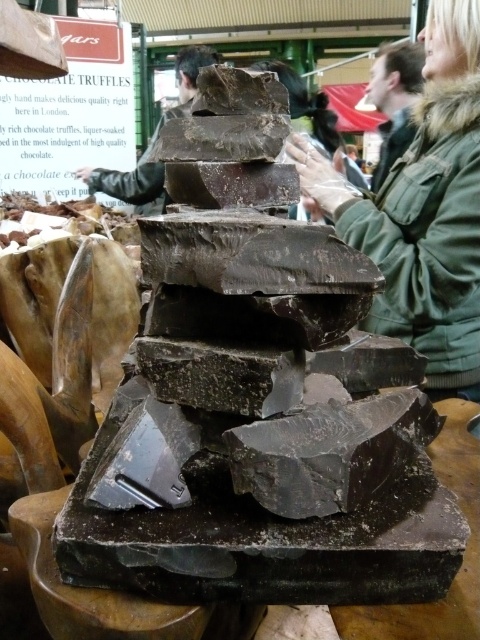
Question: Is green fuzzy coat at upper right smaller than green wool jacket at upper right?

Choices:
 (A) no
 (B) yes

Answer: (A)

Question: Which of the following is the closest to the observer?

Choices:
 (A) dark chocolate at center
 (B) green wool jacket at upper right

Answer: (B)

Question: Which object appears farthest from the camera in this image?

Choices:
 (A) green wool jacket at upper right
 (B) green fuzzy coat at upper right
 (C) dark chocolate at center

Answer: (C)

Question: Estimate the real-world distances between objects in this image. Which object is farther from the green fuzzy coat at upper right?

Choices:
 (A) dark chocolate at center
 (B) green wool jacket at upper right

Answer: (A)

Question: Is green wool jacket at upper right positioned in front of dark chocolate at center?

Choices:
 (A) no
 (B) yes

Answer: (B)

Question: Does green wool jacket at upper right have a larger size compared to dark chocolate at center?

Choices:
 (A) no
 (B) yes

Answer: (A)